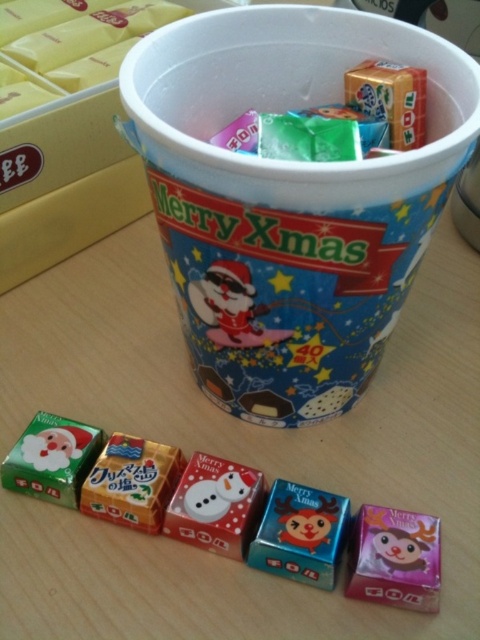
You are standing at the origin point in the image. Where is the wooden table at center located?

The wooden table at center is located at point (230, 456).

You are a customer at a Christmas market and you see the purple glossy box at lower right and the green matte santa claus at left in the cup. Which one is more to the right?

The purple glossy box at lower right is more to the right than the green matte santa claus at left.

You are a gift organizer at a Christmas party. You need to place the metallic blue candy at center into the white plastic cup at center. Given that the cup has a diameter of 4 inches, can you fit the candy inside without spilling the contents?

The white plastic cup at center and metallic blue candy at center are 21.27 inches apart. Since the distance between them is much larger than the cup diameter of 4 inches, the candy cannot be placed inside the cup without moving it closer.